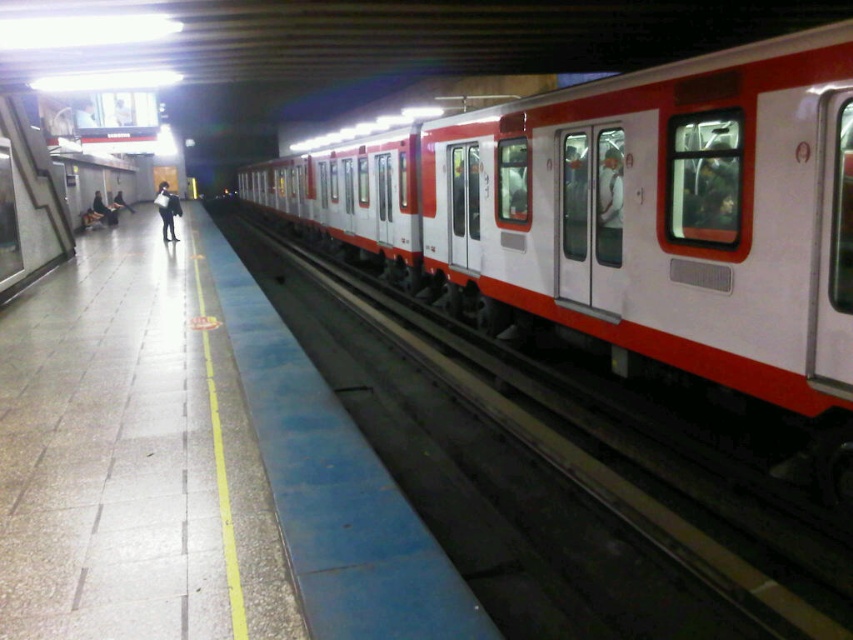
Which of these two, white glossy train at center or dark blue jeans at left, stands taller?

white glossy train at center is taller.

Does white glossy train at center appear over dark blue jeans at left?

No.

This screenshot has width=853, height=640. In order to click on white glossy train at center in this screenshot , I will do `click(630, 221)`.

Is white rubber track at right bigger than dark blue jeans at left?

Correct, white rubber track at right is larger in size than dark blue jeans at left.

Does white rubber track at right appear over dark blue jeans at left?

No.

Does point (230, 209) come behind point (96, 196)?

Yes, it is behind point (96, 196).

Where is `white rubber track at right`? This screenshot has width=853, height=640. white rubber track at right is located at coordinates (552, 474).

Who is lower down, white glossy train at center or black leather jacket at center?

Positioned lower is white glossy train at center.

Between point (712, 353) and point (161, 182), which one is positioned behind?

The point (161, 182) is more distant.

Between point (730, 392) and point (166, 182), which one is positioned in front?

Point (730, 392)

At what (x,y) coordinates should I click in order to perform the action: click on white glossy train at center. Please return your answer as a coordinate pair (x, y). Looking at the image, I should click on (630, 221).